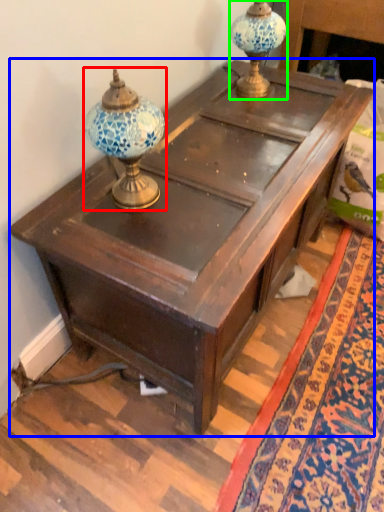
Question: Based on their relative distances, which object is farther from candle holder (highlighted by a red box)? Choose from table (highlighted by a blue box) and candle holder (highlighted by a green box).

Choices:
 (A) table
 (B) candle holder

Answer: (B)